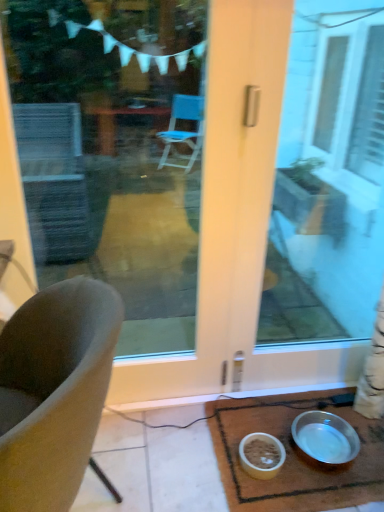
Locate an element on the screen. This screenshot has width=384, height=512. free space in front of silver metallic bowl at lower right, arranged as the 1th bowl when viewed from the right is located at coordinates (329, 493).